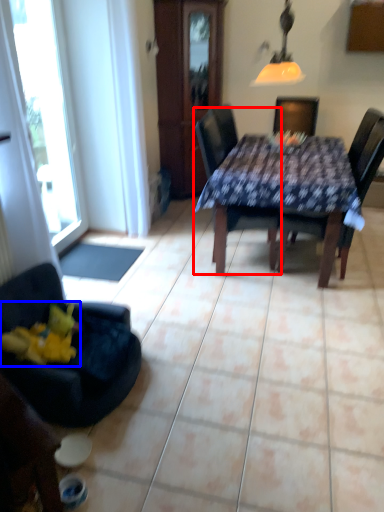
Question: Which point is further to the camera, chair (highlighted by a red box) or toy (highlighted by a blue box)?

Choices:
 (A) chair
 (B) toy

Answer: (A)